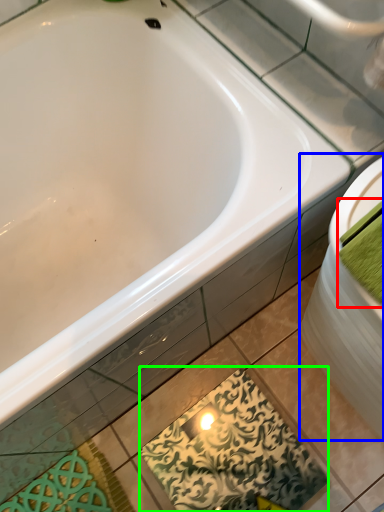
Question: Based on their relative distances, which object is nearer to bath towel (highlighted by a red box)? Choose from sink (highlighted by a blue box) and design (highlighted by a green box).

Choices:
 (A) sink
 (B) design

Answer: (A)